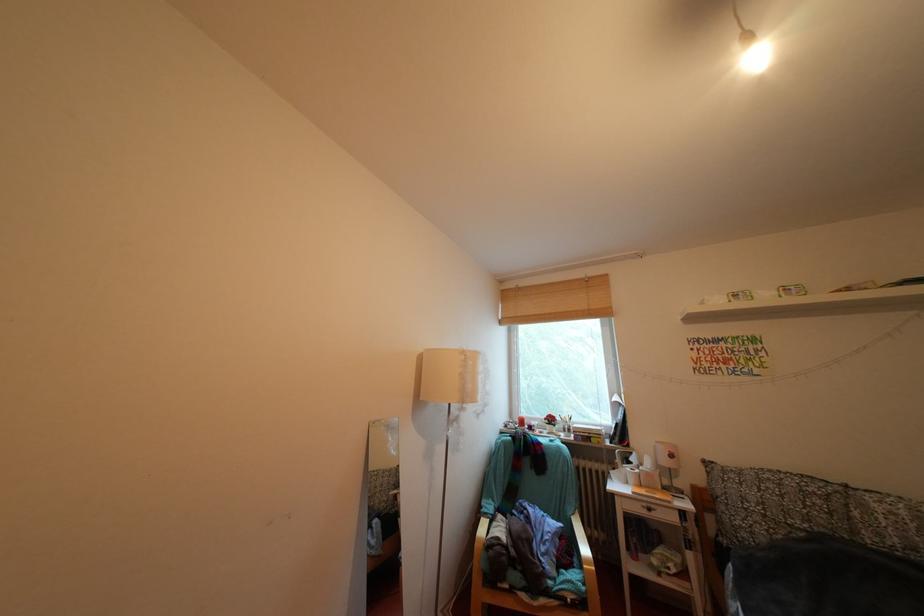
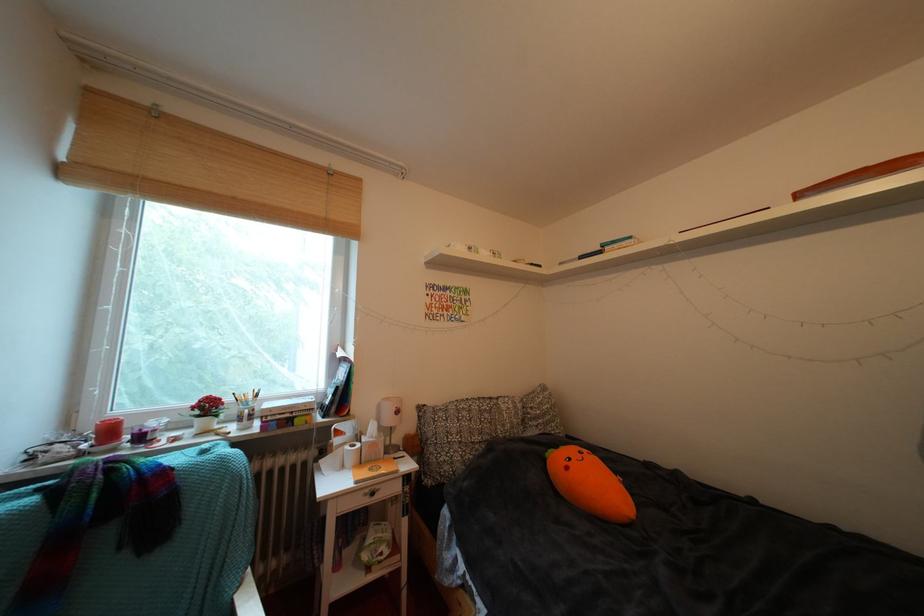
Question: The first image is from the beginning of the video and the second image is from the end. How did the camera likely rotate when shooting the video?

Choices:
 (A) Left
 (B) Right
 (C) Up
 (D) Down

Answer: (B)